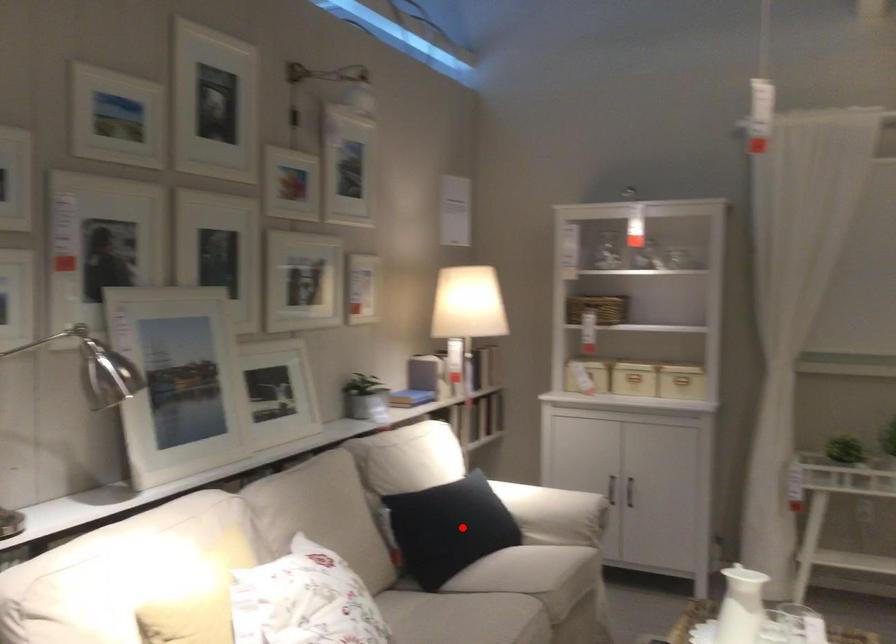
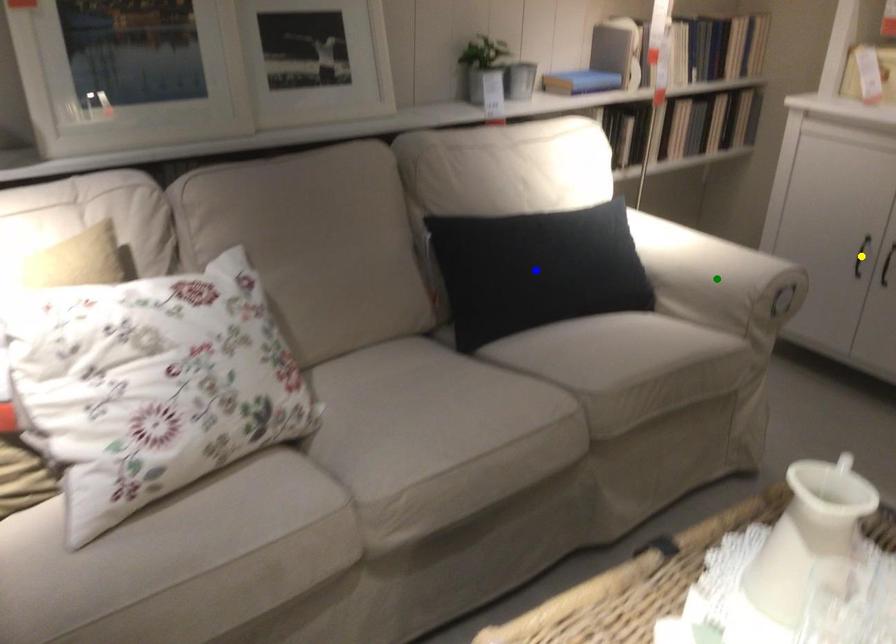
Question: I am providing you with two images of the same scene from different viewpoints. A red point is marked on the first image. You are given multiple points on the second image. Which point in image 2 is actually the same real-world point as the red point in image 1?

Choices:
 (A) blue point
 (B) green point
 (C) yellow point

Answer: (A)